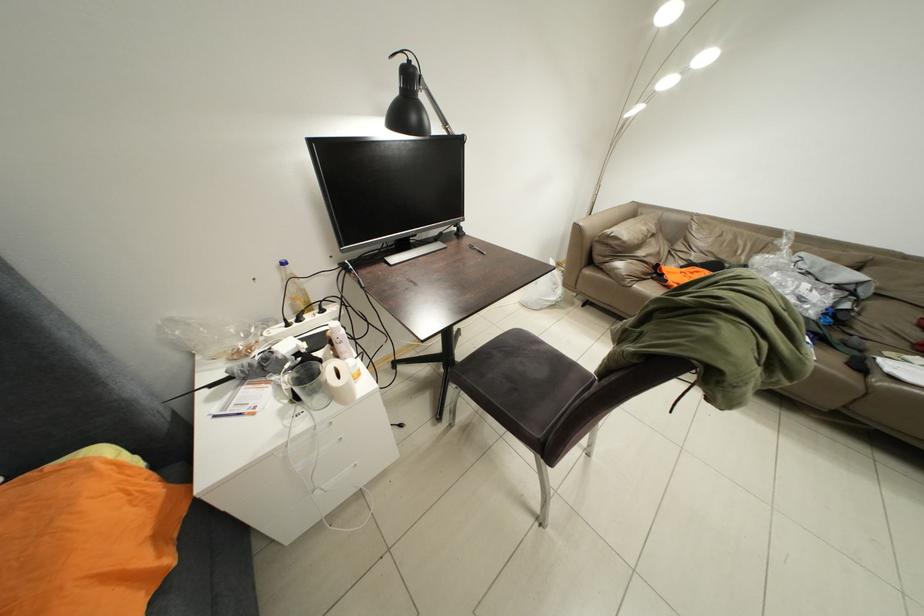
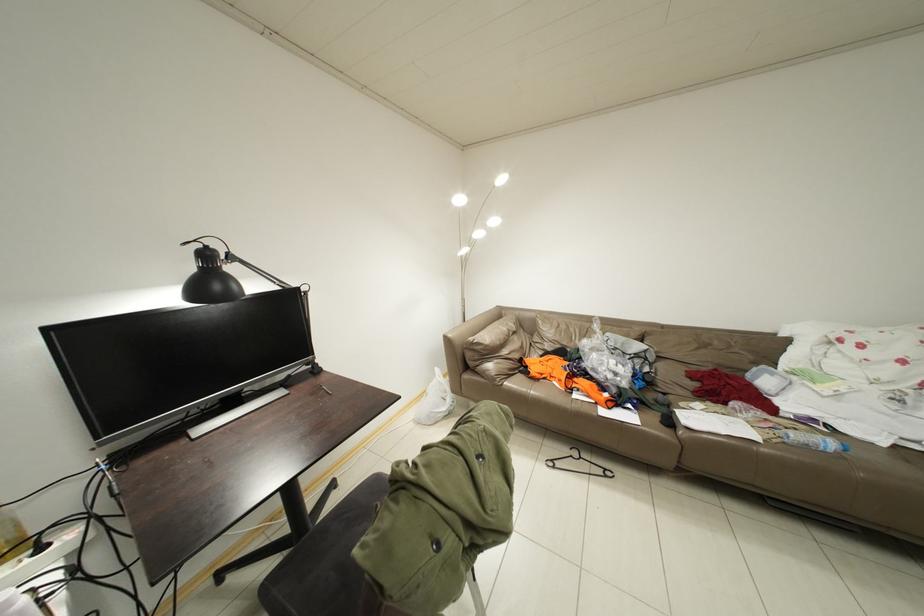
Question: What movement of the cameraman would produce the second image?

Choices:
 (A) Left
 (B) Right
 (C) Forward
 (D) Backward

Answer: (B)